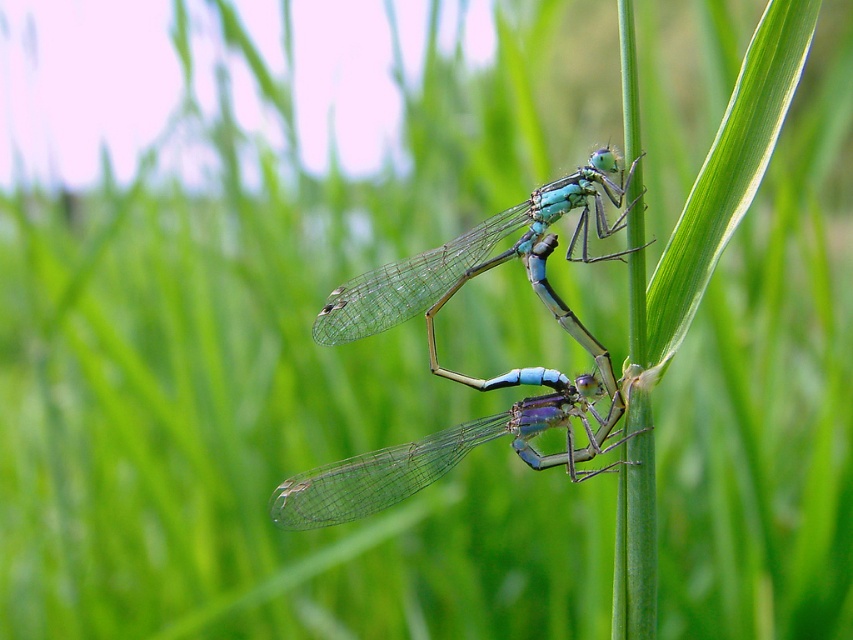
Question: Can you confirm if translucent blue dragonfly at center is positioned below translucent glass dragonfly at center?

Choices:
 (A) no
 (B) yes

Answer: (B)

Question: In this image, where is translucent blue dragonfly at center located relative to translucent glass dragonfly at center?

Choices:
 (A) left
 (B) right

Answer: (A)

Question: Which point is closer to the camera?

Choices:
 (A) translucent blue dragonfly at center
 (B) translucent glass dragonfly at center

Answer: (B)

Question: Which object is farther from the camera taking this photo?

Choices:
 (A) translucent blue dragonfly at center
 (B) translucent glass dragonfly at center

Answer: (A)

Question: Which object appears farthest from the camera in this image?

Choices:
 (A) translucent blue dragonfly at center
 (B) translucent glass dragonfly at center

Answer: (A)

Question: Does translucent blue dragonfly at center have a lesser width compared to translucent glass dragonfly at center?

Choices:
 (A) no
 (B) yes

Answer: (A)